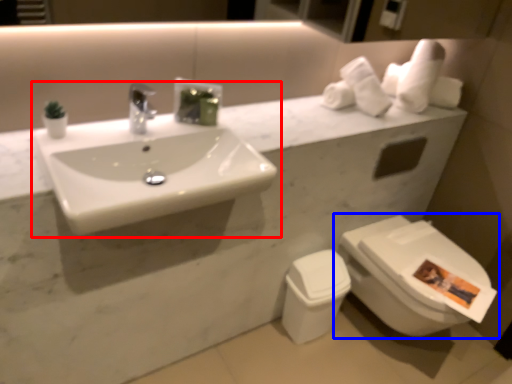
Question: Which of the following is the farthest to the observer, sink (highlighted by a red box) or toilet (highlighted by a blue box)?

Choices:
 (A) sink
 (B) toilet

Answer: (B)